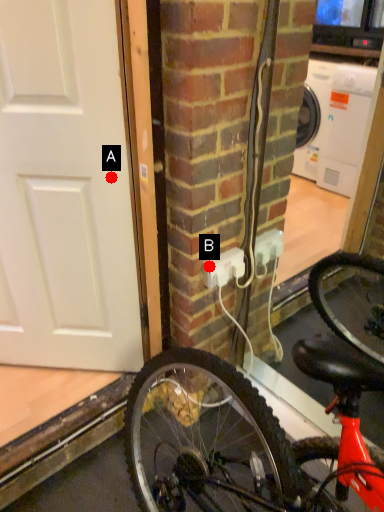
Question: Two points are circled on the image, labeled by A and B beside each circle. Among these points, which one is nearest to the camera?

Choices:
 (A) A is closer
 (B) B is closer

Answer: (A)